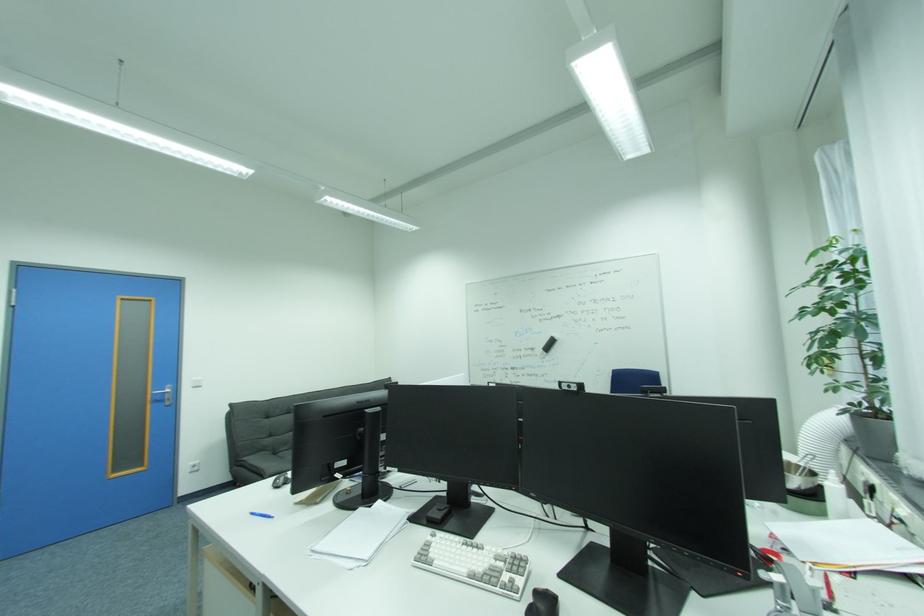
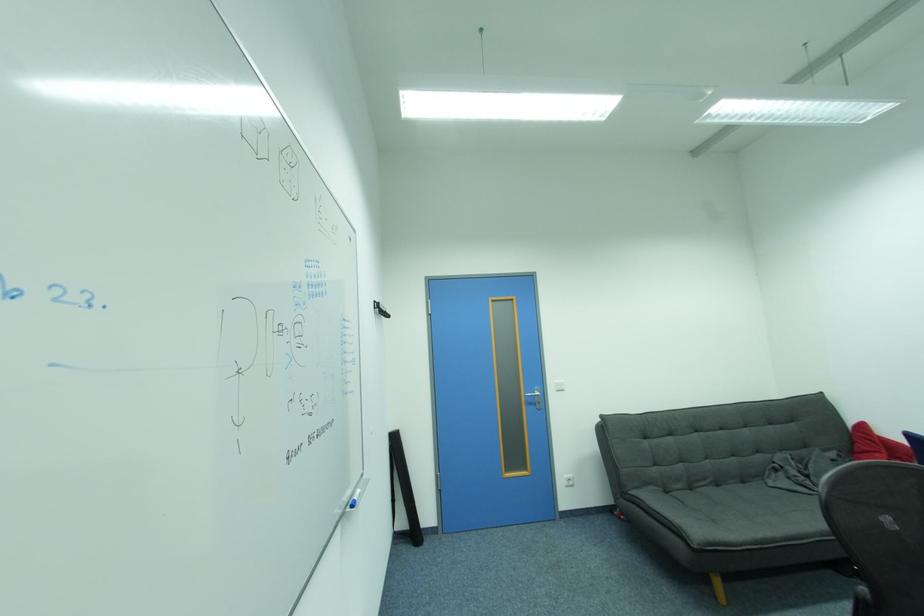
Where in the second image is the point corresponding to point 160,395 from the first image?

(532, 397)